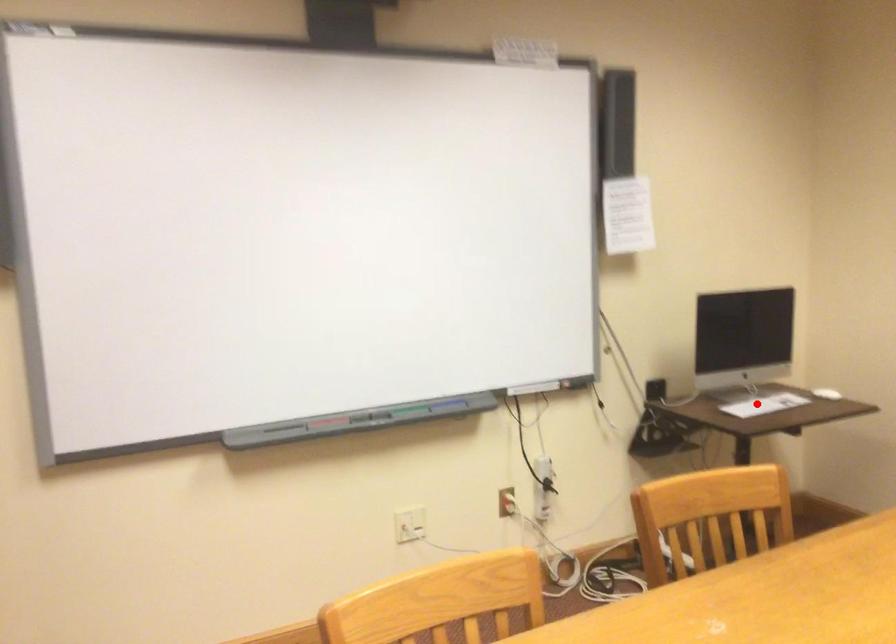
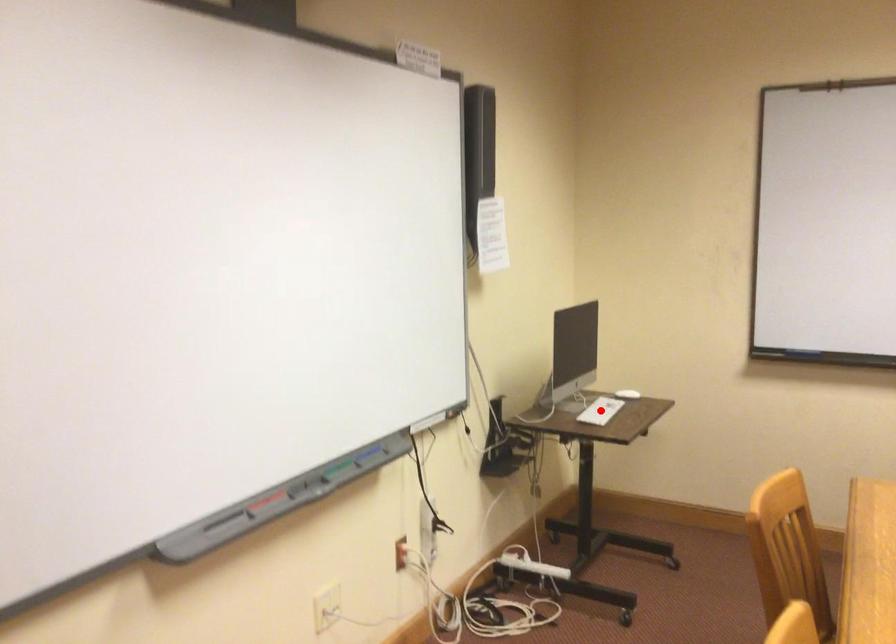
I am providing you with two images of the same scene from different viewpoints. A red point is marked on the first image and another point is marked on the second image. Do the highlighted points in image1 and image2 indicate the same real-world spot?

Yes